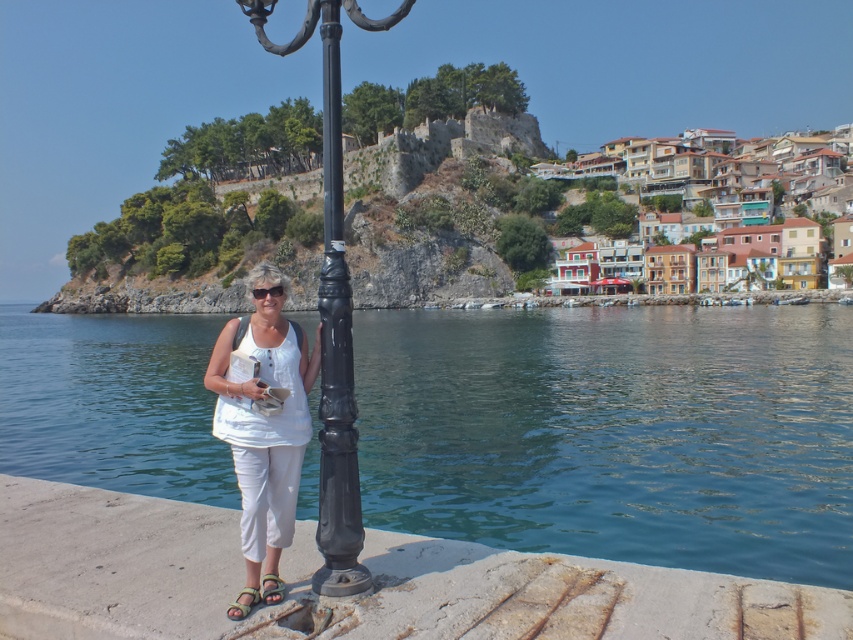
You are a photographer trying to capture the woman in the scene. You want to ensure both the white cotton tank top at center and the brown leather sandal at lower center are clearly visible in your shot. Which object should you focus on first to ensure proper framing?

The white cotton tank top at center might be wider than the brown leather sandal at lower center, so focusing on the white cotton tank top at center first would help ensure it fits within the frame before adjusting for the smaller brown leather sandal at lower center.

You are a photographer trying to capture the woman in the image. You want to focus on the white cotton tank top at center and the brown leather sandal at lower center. Which object should you adjust your camera to focus on first if you want to ensure both are in sharp focus?

You should focus on the white cotton tank top at center first because it is closer to the viewer than the brown leather sandal at lower center. By focusing on the closer object, the farther object will also be in focus due to the depth of field.

You are a photographer standing at the position of the woman in the image. You want to take a photo of two points in the scene. The first point is labeled as point (163, 320) and the second is point (250, 589). Which point will appear closer to the edge of the camera frame?

Point (250, 589) will appear closer to the edge of the camera frame because it is further away from the camera compared to point (163, 320).